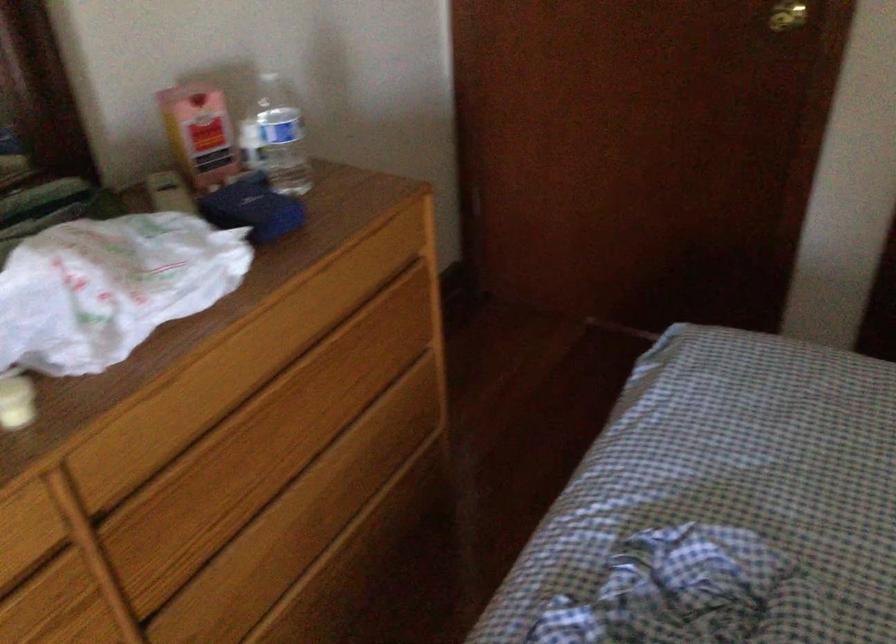
This screenshot has height=644, width=896. In order to click on plastic water bottle in this screenshot , I will do `click(276, 138)`.